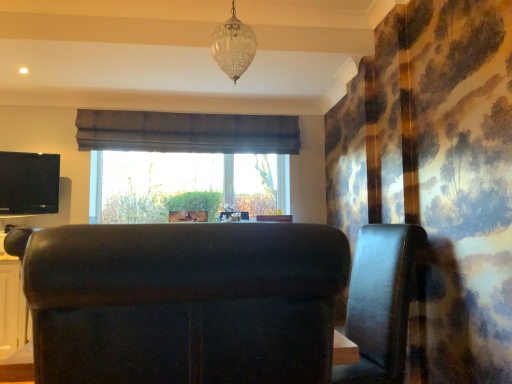
Where is `velvet dark brown armchair at center, which appears as the second furniture when viewed from the back`? Image resolution: width=512 pixels, height=384 pixels. velvet dark brown armchair at center, which appears as the second furniture when viewed from the back is located at coordinates (182, 301).

How much space does velvet dark brown armchair at center, arranged as the first furniture when viewed from the left, occupy horizontally?

The width of velvet dark brown armchair at center, arranged as the first furniture when viewed from the left, is 23.08 inches.

Where is `leather armchair at center, arranged as the second furniture when viewed from the left`? Image resolution: width=512 pixels, height=384 pixels. leather armchair at center, arranged as the second furniture when viewed from the left is located at coordinates (380, 302).

What is the approximate height of clear glass chandelier at upper center?

20.65 inches.

This screenshot has height=384, width=512. In order to click on velvet dark brown armchair at center, acting as the second furniture starting from the right in this screenshot , I will do `click(182, 301)`.

From the image's perspective, is clear glass chandelier at upper center below matte black tv at left?

No, from the image's perspective, clear glass chandelier at upper center is not beneath matte black tv at left.

Is clear glass chandelier at upper center facing away from matte black tv at left?

No, clear glass chandelier at upper center's orientation is not away from matte black tv at left.

This screenshot has width=512, height=384. I want to click on lamp above the matte black tv at left (from a real-world perspective), so [234, 46].

Is clear glass chandelier at upper center placed right next to matte black tv at left?

No, clear glass chandelier at upper center is not touching matte black tv at left.

Who is taller, leather armchair at center, the first furniture from the back, or velvet dark brown armchair at center, positioned as the first furniture in front-to-back order?

With more height is leather armchair at center, the first furniture from the back.

From the picture: Which is less distant, (392, 306) or (290, 351)?

Point (392, 306) is positioned farther from the camera compared to point (290, 351).

Is leather armchair at center, acting as the second furniture starting from the front, looking in the opposite direction of velvet dark brown armchair at center, which appears as the second furniture when viewed from the back?

leather armchair at center, acting as the second furniture starting from the front, is not turned away from velvet dark brown armchair at center, which appears as the second furniture when viewed from the back.

From a real-world perspective, between leather armchair at center, the first furniture from the back, and velvet dark brown armchair at center, arranged as the first furniture when viewed from the left, who is vertically higher?

velvet dark brown armchair at center, arranged as the first furniture when viewed from the left, is physically above.

Which object is more forward, velvet dark brown armchair at center, acting as the second furniture starting from the right, or brown fabric curtain at center?

velvet dark brown armchair at center, acting as the second furniture starting from the right, is more forward.

Which is closer, (x=42, y=298) or (x=228, y=128)?

Clearly, point (x=42, y=298) is closer to the camera than point (x=228, y=128).

At what (x,y) coordinates should I click in order to perform the action: click on the 2nd furniture in front of the brown fabric curtain at center. Please return your answer as a coordinate pair (x, y). The width and height of the screenshot is (512, 384). Looking at the image, I should click on (182, 301).

Is brown fabric curtain at center inside velvet dark brown armchair at center, arranged as the first furniture when viewed from the left?

Actually, brown fabric curtain at center is outside velvet dark brown armchair at center, arranged as the first furniture when viewed from the left.

From the image's perspective, which one is positioned higher, velvet dark brown armchair at center, acting as the second furniture starting from the right, or matte black tv at left?

From the image's view, matte black tv at left is above.

Would you say velvet dark brown armchair at center, arranged as the first furniture when viewed from the left, is inside or outside matte black tv at left?

velvet dark brown armchair at center, arranged as the first furniture when viewed from the left, cannot be found inside matte black tv at left.

Image resolution: width=512 pixels, height=384 pixels. Identify the location of the 1st furniture positioned below the matte black tv at left (from the image's perspective). (182, 301).

Is velvet dark brown armchair at center, acting as the second furniture starting from the right, looking in the opposite direction of matte black tv at left?

No, velvet dark brown armchair at center, acting as the second furniture starting from the right,'s orientation is not away from matte black tv at left.

Considering the positions of objects brown fabric curtain at center and velvet dark brown armchair at center, acting as the second furniture starting from the right, in the image provided, who is behind, brown fabric curtain at center or velvet dark brown armchair at center, acting as the second furniture starting from the right,?

brown fabric curtain at center is further from the camera.

Is brown fabric curtain at center located outside velvet dark brown armchair at center, arranged as the first furniture when viewed from the left?

Yes, brown fabric curtain at center is outside of velvet dark brown armchair at center, arranged as the first furniture when viewed from the left.

From the image's perspective, relative to velvet dark brown armchair at center, arranged as the first furniture when viewed from the left, is brown fabric curtain at center above or below?

brown fabric curtain at center is above velvet dark brown armchair at center, arranged as the first furniture when viewed from the left.

Are clear glass chandelier at upper center and brown fabric curtain at center far apart?

Yes.

What are the coordinates of `lamp above the brown fabric curtain at center (from a real-world perspective)` in the screenshot? It's located at [x=234, y=46].

Measure the distance between clear glass chandelier at upper center and brown fabric curtain at center.

A distance of 1.76 meters exists between clear glass chandelier at upper center and brown fabric curtain at center.

Would you say clear glass chandelier at upper center is inside or outside brown fabric curtain at center?

clear glass chandelier at upper center cannot be found inside brown fabric curtain at center.

Considering the sizes of matte black tv at left and clear glass chandelier at upper center in the image, is matte black tv at left taller or shorter than clear glass chandelier at upper center?

matte black tv at left is shorter than clear glass chandelier at upper center.

Considering the relative positions of matte black tv at left and clear glass chandelier at upper center in the image provided, is matte black tv at left to the left of clear glass chandelier at upper center from the viewer's perspective?

Indeed, matte black tv at left is positioned on the left side of clear glass chandelier at upper center.

Which is correct: matte black tv at left is inside clear glass chandelier at upper center, or outside of it?

matte black tv at left lies outside clear glass chandelier at upper center.

Does matte black tv at left touch clear glass chandelier at upper center?

No, matte black tv at left is not in contact with clear glass chandelier at upper center.

The width and height of the screenshot is (512, 384). Find the location of `lamp above the matte black tv at left (from the image's perspective)`. lamp above the matte black tv at left (from the image's perspective) is located at coordinates (234, 46).

Locate an element on the screen. furniture beneath the velvet dark brown armchair at center, positioned as the first furniture in front-to-back order (from a real-world perspective) is located at coordinates (380, 302).

Looking at the image, which one is located further to velvet dark brown armchair at center, which appears as the second furniture when viewed from the back, clear glass chandelier at upper center or leather armchair at center, the first furniture from the back?

clear glass chandelier at upper center is positioned further to the anchor velvet dark brown armchair at center, which appears as the second furniture when viewed from the back.

Based on the photo, which object lies nearer to the anchor point leather armchair at center, acting as the second furniture starting from the front, clear glass chandelier at upper center or velvet dark brown armchair at center, acting as the second furniture starting from the right?

The object closer to leather armchair at center, acting as the second furniture starting from the front, is velvet dark brown armchair at center, acting as the second furniture starting from the right.

Based on their spatial positions, is matte black tv at left or leather armchair at center, the 1th furniture from the right, closer to clear glass chandelier at upper center?

leather armchair at center, the 1th furniture from the right, lies closer to clear glass chandelier at upper center than the other object.

When comparing their distances from brown fabric curtain at center, does leather armchair at center, acting as the second furniture starting from the front, or clear glass chandelier at upper center seem further?

leather armchair at center, acting as the second furniture starting from the front, lies further to brown fabric curtain at center than the other object.

From the image, which object appears to be farther from brown fabric curtain at center, clear glass chandelier at upper center or velvet dark brown armchair at center, arranged as the first furniture when viewed from the left?

The object further to brown fabric curtain at center is velvet dark brown armchair at center, arranged as the first furniture when viewed from the left.

From the picture: Looking at the image, which one is located further to leather armchair at center, the 1th furniture from the right, clear glass chandelier at upper center or matte black tv at left?

matte black tv at left lies further to leather armchair at center, the 1th furniture from the right, than the other object.

Which object lies further to the anchor point leather armchair at center, arranged as the second furniture when viewed from the left, velvet dark brown armchair at center, acting as the second furniture starting from the right, or clear glass chandelier at upper center?

clear glass chandelier at upper center.

Based on their spatial positions, is clear glass chandelier at upper center or leather armchair at center, acting as the second furniture starting from the front, further from matte black tv at left?

Based on the image, leather armchair at center, acting as the second furniture starting from the front, appears to be further to matte black tv at left.

Identify the location of lamp between matte black tv at left and leather armchair at center, the 1th furniture from the right. (234, 46).

Locate an element on the screen. The width and height of the screenshot is (512, 384). furniture between velvet dark brown armchair at center, positioned as the first furniture in front-to-back order, and clear glass chandelier at upper center, along the z-axis is located at coordinates (380, 302).

Where is `curtain between matte black tv at left and leather armchair at center, acting as the second furniture starting from the front, from left to right`? This screenshot has height=384, width=512. curtain between matte black tv at left and leather armchair at center, acting as the second furniture starting from the front, from left to right is located at coordinates (186, 132).

Identify the location of wide positioned between velvet dark brown armchair at center, which appears as the second furniture when viewed from the back, and brown fabric curtain at center from near to far. (29, 183).